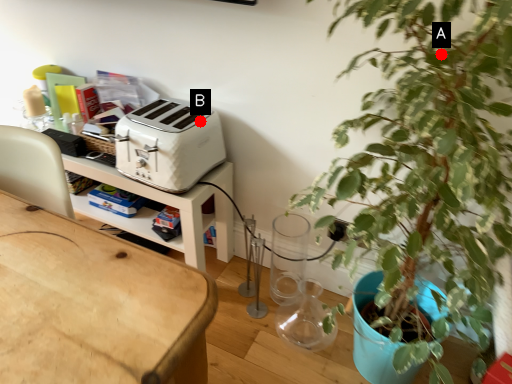
Question: Two points are circled on the image, labeled by A and B beside each circle. Which point is farther to the camera?

Choices:
 (A) A is further
 (B) B is further

Answer: (B)